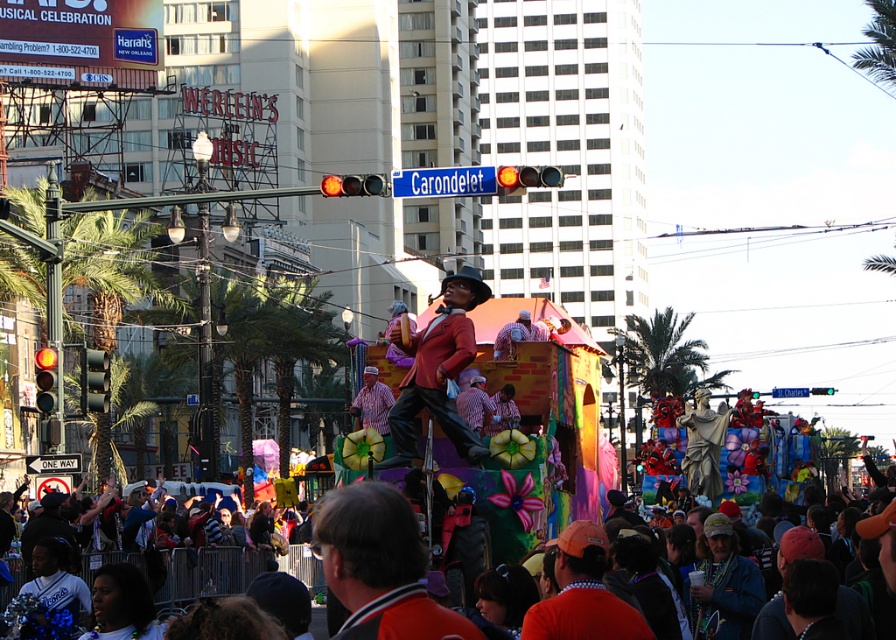
Is orange jersey at center to the left of matte red suit at center from the viewer's perspective?

Indeed, orange jersey at center is positioned on the left side of matte red suit at center.

Does orange jersey at center appear under matte red suit at center?

Yes.

Identify the location of orange jersey at center. The height and width of the screenshot is (640, 896). (380, 566).

This screenshot has height=640, width=896. In order to click on orange jersey at center in this screenshot , I will do `click(380, 566)`.

Consider the image. Is matte red suit at center below orange fabric at center?

Actually, matte red suit at center is above orange fabric at center.

Does matte red suit at center appear on the right side of orange fabric at center?

Incorrect, matte red suit at center is not on the right side of orange fabric at center.

Where is `matte red suit at center`? This screenshot has height=640, width=896. matte red suit at center is located at coordinates (438, 371).

Who is higher up, orange jersey at center or orange fabric at center?

Positioned higher is orange jersey at center.

Is orange jersey at center thinner than orange fabric at center?

Incorrect, orange jersey at center's width is not less than orange fabric at center's.

Who is more forward, [397,577] or [630,630]?

Positioned in front is point [397,577].

The width and height of the screenshot is (896, 640). I want to click on orange jersey at center, so click(x=380, y=566).